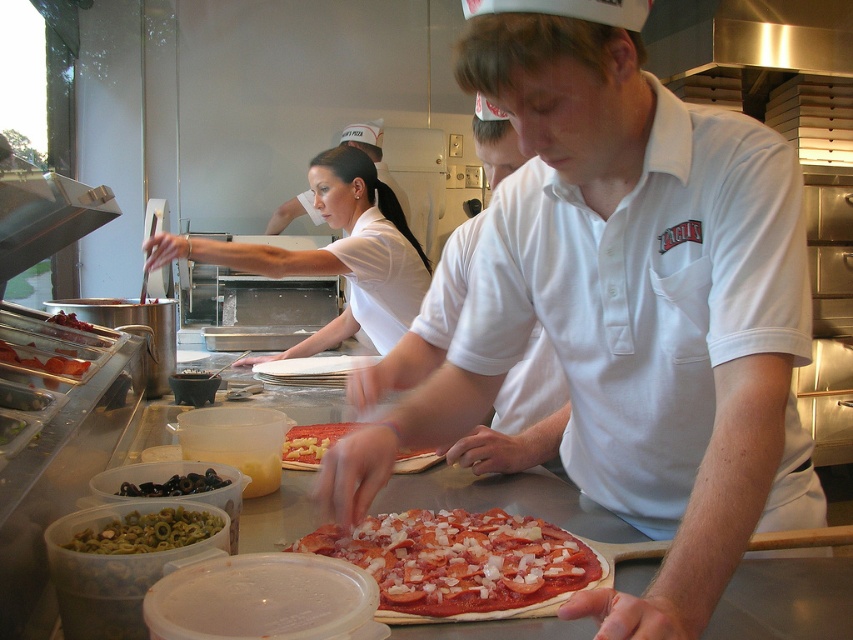
Is point (190, 529) positioned in front of point (345, 432)?

Yes, point (190, 529) is in front of point (345, 432).

Does point (120, 544) lie behind point (409, 468)?

No, (120, 544) is in front of (409, 468).

Identify the location of green olive oil at lower left. (148, 531).

Can you confirm if white matte shirt at center is smaller than stainless steel exhaust hood at upper right?

No, white matte shirt at center is not smaller than stainless steel exhaust hood at upper right.

Does white matte shirt at center have a lesser height compared to stainless steel exhaust hood at upper right?

Incorrect, white matte shirt at center's height does not fall short of stainless steel exhaust hood at upper right's.

Is point (645, 83) farther from camera compared to point (666, 72)?

No.

The width and height of the screenshot is (853, 640). Identify the location of white matte shirt at center. (627, 305).

Is point (550, 221) positioned behind point (177, 243)?

That is False.

Does white matte shirt at center have a smaller size compared to white smooth uniform at center?

Indeed, white matte shirt at center has a smaller size compared to white smooth uniform at center.

Where is `white matte shirt at center`? The image size is (853, 640). white matte shirt at center is located at coordinates (627, 305).